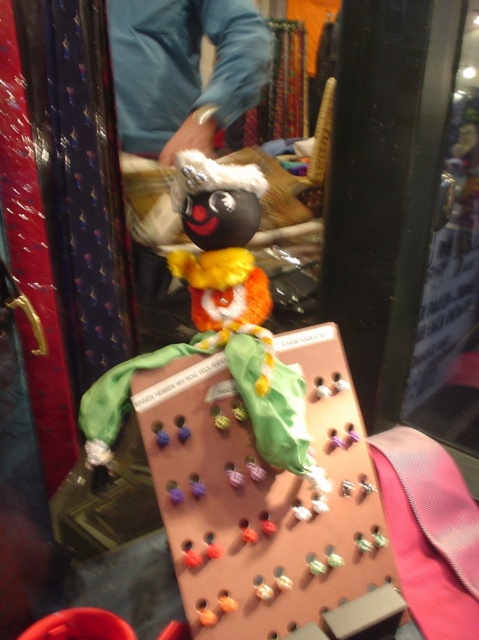
Which of these two, transparent glass at center or blue fabric at upper center, stands shorter?

With less height is blue fabric at upper center.

Can you confirm if transparent glass at center is shorter than blue fabric at upper center?

Incorrect, transparent glass at center's height does not fall short of blue fabric at upper center's.

Which is in front, point (438, 93) or point (128, 4)?

Point (438, 93)

Image resolution: width=479 pixels, height=640 pixels. In order to click on transparent glass at center in this screenshot , I will do `click(447, 250)`.